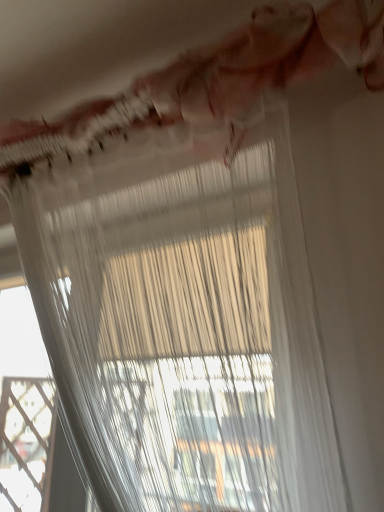
Measure the distance between point (167, 91) and camera.

Point (167, 91) and camera are 3.44 feet apart from each other.

Image resolution: width=384 pixels, height=512 pixels. I want to click on translucent white curtain at upper center, so click(x=216, y=78).

The height and width of the screenshot is (512, 384). Describe the element at coordinates (216, 78) in the screenshot. I see `translucent white curtain at upper center` at that location.

You are a GUI agent. You are given a task and a screenshot of the screen. Output one action in this format:
    pyautogui.click(x=<x>, y=<y>)
    Task: Click on the translucent white curtain at upper center
    This screenshot has height=512, width=384.
    Given the screenshot: What is the action you would take?
    pyautogui.click(x=216, y=78)